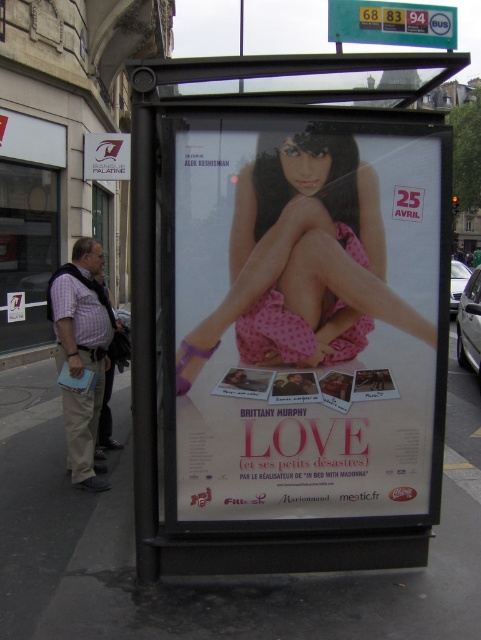
What are the coordinates of the pink polka dot dress at center in the bus stop advertisement poster?

The pink polka dot dress at center is located at coordinates point (253, 209).